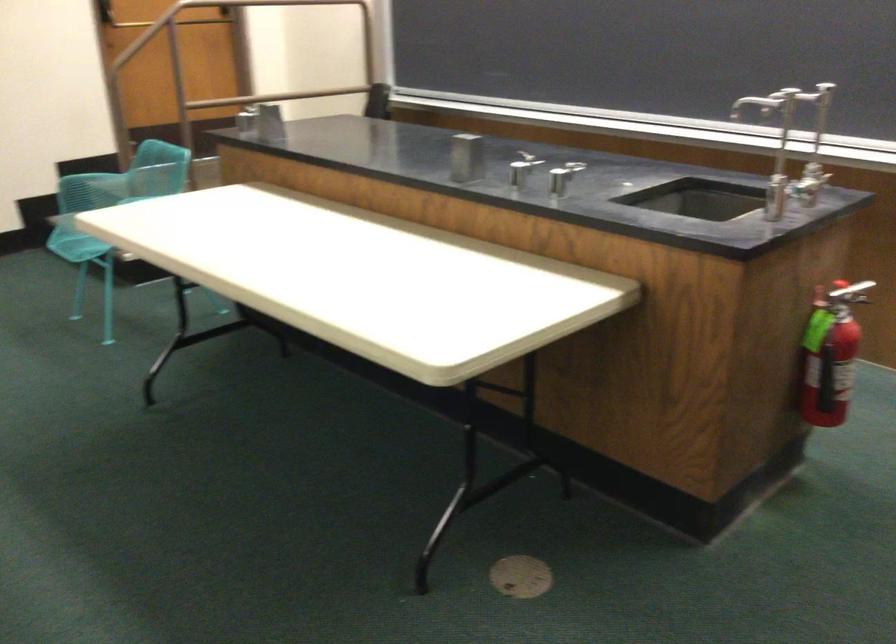
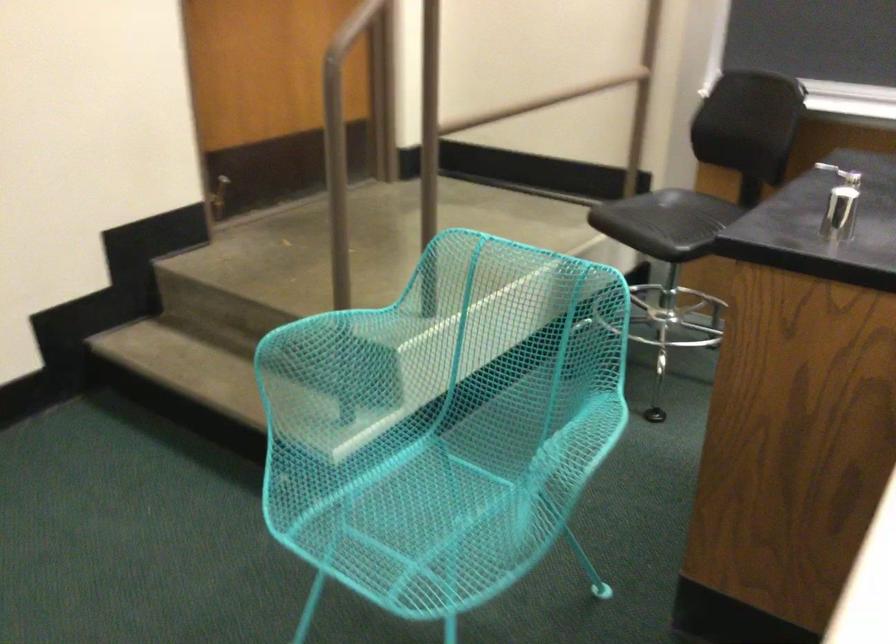
Looking at this image, which direction would the cameraman need to move to produce the second image?

The cameraman walked toward left, forward.